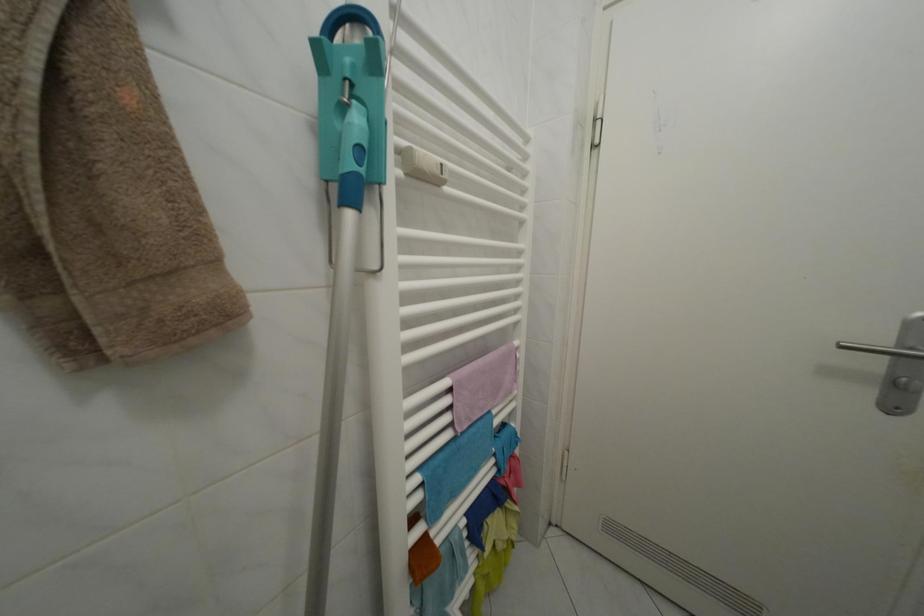
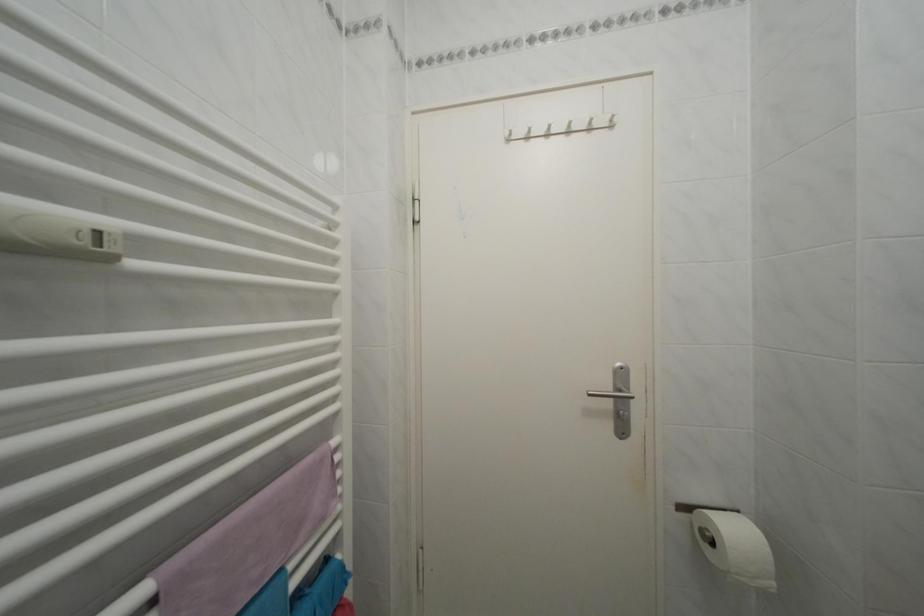
Question: In a continuous first-person perspective shot, in which direction is the camera moving?

Choices:
 (A) Left
 (B) Right
 (C) Forward
 (D) Backward

Answer: (B)